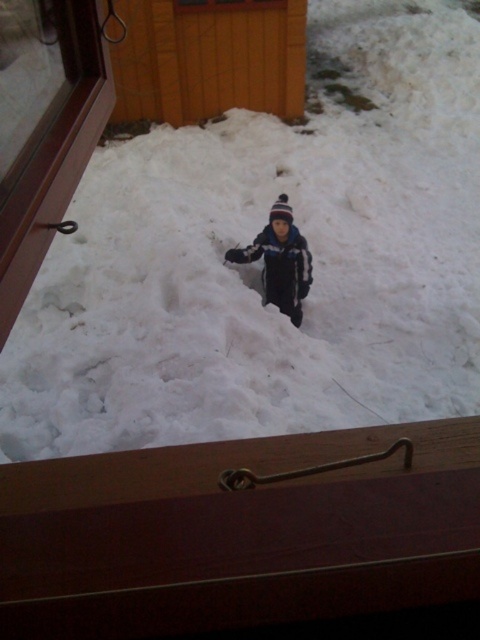
Question: Can you confirm if white fluffy snow at center is wider than dark blue fleece jacket at center?

Choices:
 (A) no
 (B) yes

Answer: (B)

Question: Which of the following is the closest to the observer?

Choices:
 (A) dark blue fleece jacket at center
 (B) white fluffy snow at center

Answer: (B)

Question: Which object appears farthest from the camera in this image?

Choices:
 (A) dark blue fleece jacket at center
 (B) white fluffy snow at center

Answer: (A)

Question: Is white fluffy snow at center further to camera compared to dark blue fleece jacket at center?

Choices:
 (A) yes
 (B) no

Answer: (B)

Question: Is white fluffy snow at center closer to the viewer compared to dark blue fleece jacket at center?

Choices:
 (A) yes
 (B) no

Answer: (A)